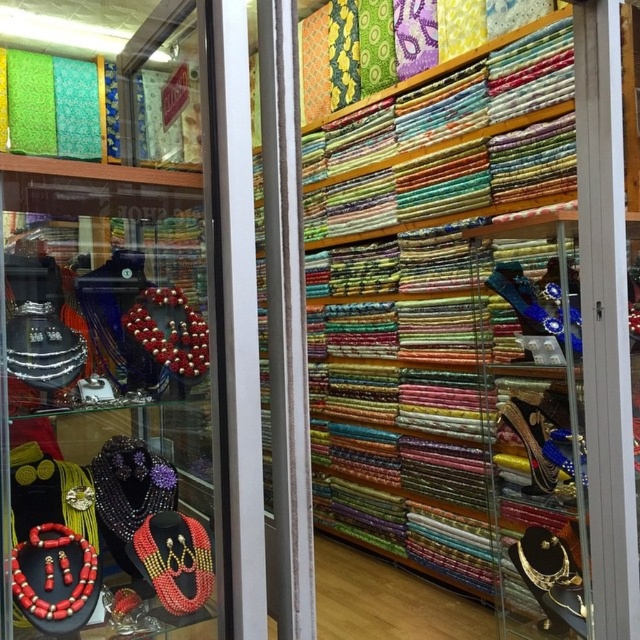
Question: Can you confirm if matte black jewelry at left is smaller than metallic gold shoe at center-right?

Choices:
 (A) no
 (B) yes

Answer: (A)

Question: Can you confirm if matte black jewelry at left is positioned to the left of metallic gold shoe at center-right?

Choices:
 (A) yes
 (B) no

Answer: (A)

Question: Which point is closer to the camera taking this photo?

Choices:
 (A) (100, 422)
 (B) (536, 445)

Answer: (A)

Question: Can you confirm if matte black jewelry at left is smaller than metallic gold shoe at center-right?

Choices:
 (A) yes
 (B) no

Answer: (B)